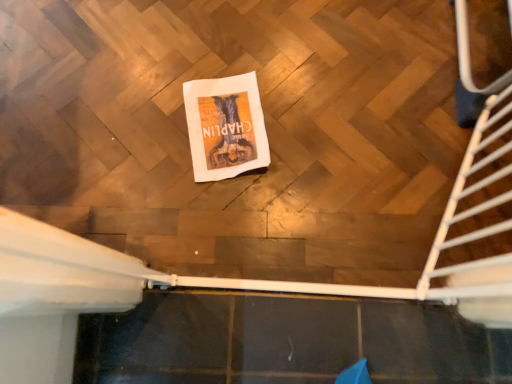
The image size is (512, 384). I want to click on free space to the left of white paper towel at center, so click(139, 122).